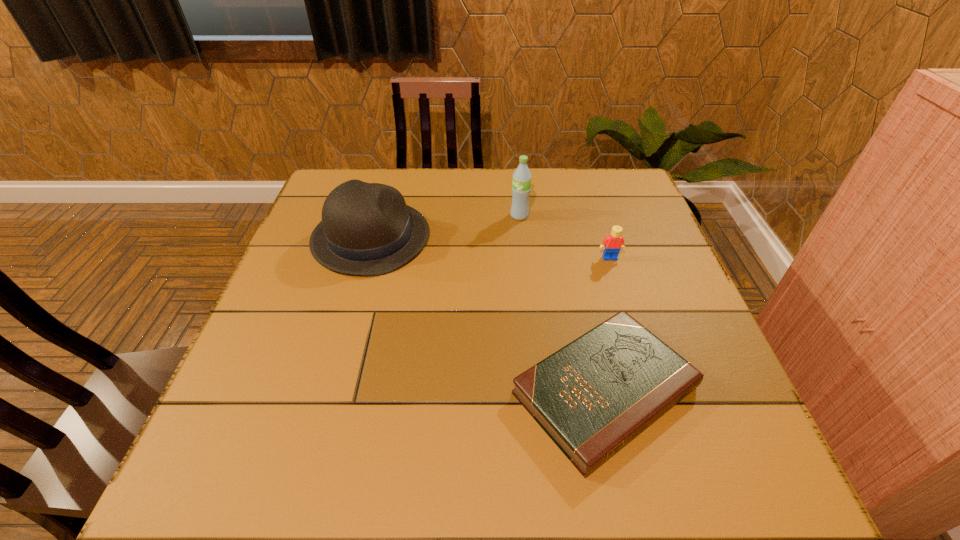
Where is `vacant area at the left edge of the desktop`? The width and height of the screenshot is (960, 540). vacant area at the left edge of the desktop is located at coordinates pos(291,259).

Locate an element on the screen. This screenshot has height=540, width=960. vacant region at the right edge is located at coordinates (701, 357).

Find the location of `free location at the far right corner`. free location at the far right corner is located at coordinates (625, 171).

Where is `vacant area at the near right corner of the desktop`? vacant area at the near right corner of the desktop is located at coordinates (690, 451).

I want to click on empty location between the leftmost object and the tallest object, so click(x=445, y=227).

This screenshot has height=540, width=960. What are the coordinates of `unoccupied area between the water bottle and the bowler hat` in the screenshot? It's located at 445,227.

Where is `vacant area that lies between the tallest object and the third shortest object`? vacant area that lies between the tallest object and the third shortest object is located at coordinates (445, 227).

Identify the location of free space that is in between the third shortest object and the Lego. (491, 248).

Locate an element on the screen. Image resolution: width=960 pixels, height=540 pixels. free space between the water bottle and the second shortest object is located at coordinates (564, 237).

Identify the location of free space between the nearest object and the leftmost object. (488, 314).